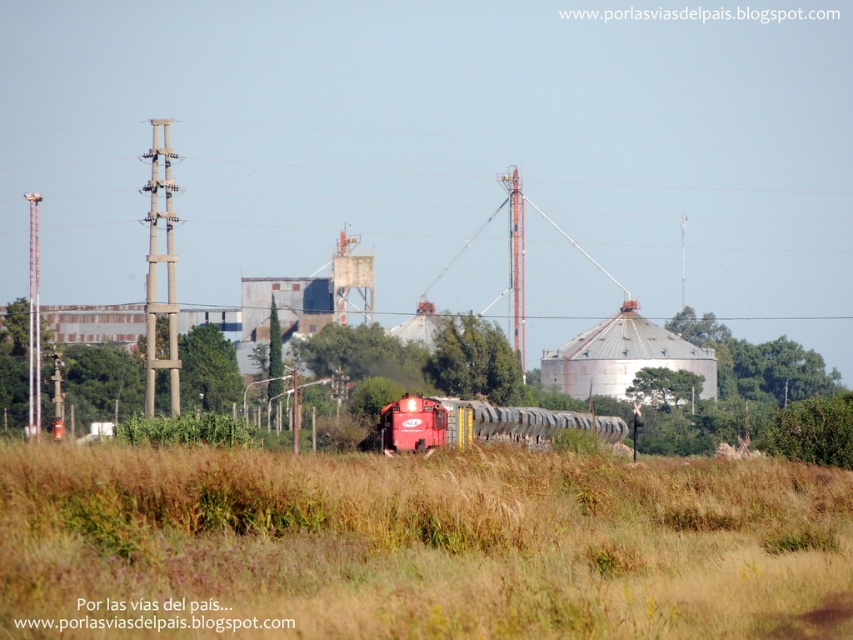
You are standing at the point marked as point (416, 545) in the image. What do you see directly in front of you?

You see the brown grassy field at center directly in front of you at point (416, 545).

You are a photographer trying to capture the matte red train at center and the brown grassy field at center in a single shot. Based on their positions, which object is on the right side of the other?

The brown grassy field at center is positioned on the right side of matte red train at center.

You are standing in the rural landscape and notice the brown grassy field at center and the matte red train at center. Which object is positioned higher in the image?

The brown grassy field at center is located above the matte red train at center, so it is positioned higher in the image.